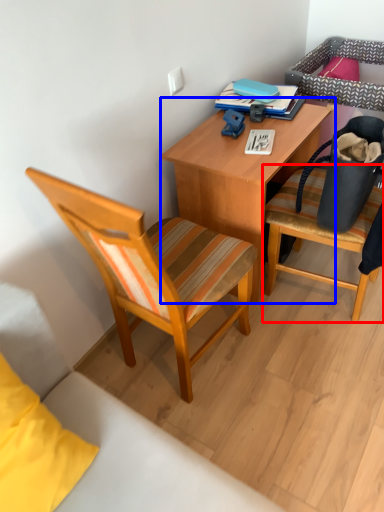
Question: Which object appears farthest to the camera in this image, chair (highlighted by a red box) or desk (highlighted by a blue box)?

Choices:
 (A) chair
 (B) desk

Answer: (B)